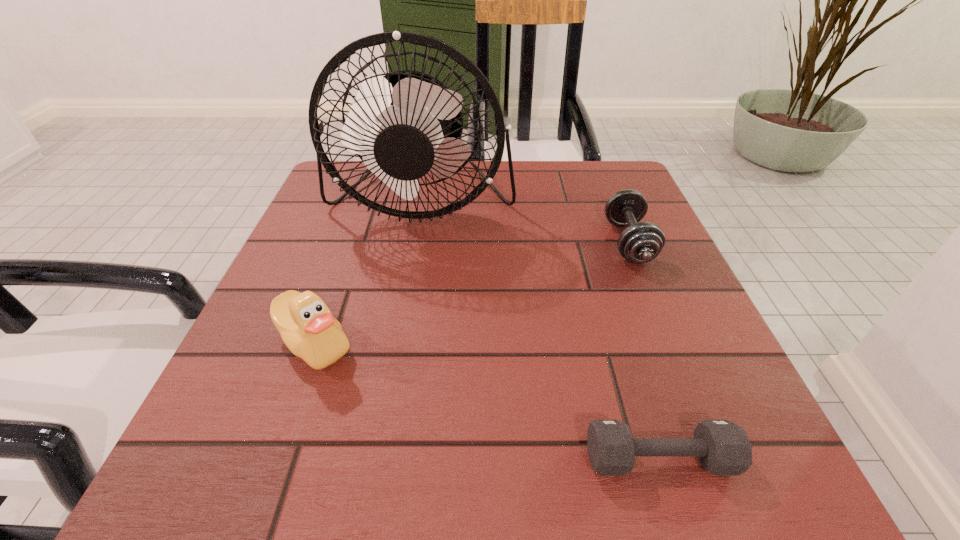
I want to click on free space between the fan and the third tallest object, so click(525, 221).

The width and height of the screenshot is (960, 540). Identify the location of free space between the third shortest object and the farther dumbbell. (471, 293).

You are a GUI agent. You are given a task and a screenshot of the screen. Output one action in this format:
    pyautogui.click(x=<x>, y=<y>)
    Task: Click on the unoccupied area between the nearest object and the fan
    
    Given the screenshot: What is the action you would take?
    pyautogui.click(x=540, y=330)

Identify which object is the second nearest to the tallest object. Please provide its 2D coordinates. Your answer should be formatted as a tuple, i.e. [(x, y)], where the tuple contains the x and y coordinates of a point satisfying the conditions above.

[(307, 327)]

Identify which object is located as the third nearest to the fan. Please provide its 2D coordinates. Your answer should be formatted as a tuple, i.e. [(x, y)], where the tuple contains the x and y coordinates of a point satisfying the conditions above.

[(722, 447)]

Where is `vacant space that satisfies the following two spatial constraints: 1. at the beak of the third farthest object; 2. on the right side of the nearer dumbbell`? The width and height of the screenshot is (960, 540). vacant space that satisfies the following two spatial constraints: 1. at the beak of the third farthest object; 2. on the right side of the nearer dumbbell is located at coordinates pos(274,458).

Locate an element on the screen. The height and width of the screenshot is (540, 960). blank area in the image that satisfies the following two spatial constraints: 1. in front of the fan, directing airflow; 2. on the right side of the farther dumbbell is located at coordinates (415, 242).

This screenshot has height=540, width=960. Find the location of `vacant area in the image that satisfies the following two spatial constraints: 1. at the beak of the second tallest object; 2. on the right side of the nearest object`. vacant area in the image that satisfies the following two spatial constraints: 1. at the beak of the second tallest object; 2. on the right side of the nearest object is located at coordinates (274, 458).

Where is `free space that satisfies the following two spatial constraints: 1. at the beak of the second tallest object; 2. on the right side of the shorter dumbbell`? free space that satisfies the following two spatial constraints: 1. at the beak of the second tallest object; 2. on the right side of the shorter dumbbell is located at coordinates (274, 458).

This screenshot has height=540, width=960. In order to click on vacant position in the image that satisfies the following two spatial constraints: 1. at the beak of the shorter dumbbell; 2. on the left side of the duck in this screenshot , I will do [274, 458].